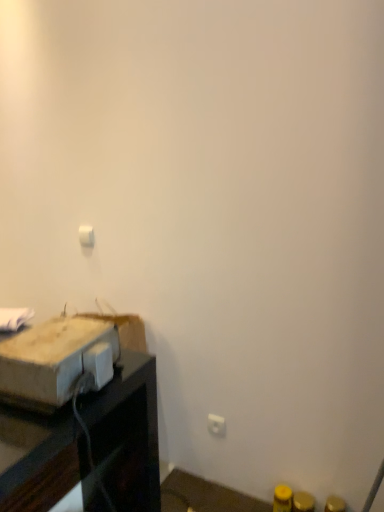
Question: From a real-world perspective, is white plastic light switch at upper center located higher than brown cardboard box at left?

Choices:
 (A) no
 (B) yes

Answer: (B)

Question: From the image's perspective, is white plastic light switch at upper center located beneath brown cardboard box at left?

Choices:
 (A) yes
 (B) no

Answer: (B)

Question: From the image's perspective, is white plastic light switch at upper center above brown cardboard box at left?

Choices:
 (A) yes
 (B) no

Answer: (A)

Question: Is white plastic light switch at upper center shorter than brown cardboard box at left?

Choices:
 (A) no
 (B) yes

Answer: (B)

Question: Is white plastic light switch at upper center positioned before brown cardboard box at left?

Choices:
 (A) no
 (B) yes

Answer: (A)

Question: Is white plastic light switch at upper center in contact with brown cardboard box at left?

Choices:
 (A) no
 (B) yes

Answer: (A)

Question: Considering the relative sizes of white plastic electric outlet at lower right and brown cardboard box at left in the image provided, is white plastic electric outlet at lower right taller than brown cardboard box at left?

Choices:
 (A) no
 (B) yes

Answer: (B)

Question: Is white plastic electric outlet at lower right to the left of brown cardboard box at left from the viewer's perspective?

Choices:
 (A) yes
 (B) no

Answer: (B)

Question: Does white plastic electric outlet at lower right have a larger size compared to brown cardboard box at left?

Choices:
 (A) no
 (B) yes

Answer: (A)

Question: From the image's perspective, is white plastic electric outlet at lower right below brown cardboard box at left?

Choices:
 (A) yes
 (B) no

Answer: (A)

Question: Does white plastic electric outlet at lower right have a lesser width compared to brown cardboard box at left?

Choices:
 (A) no
 (B) yes

Answer: (B)

Question: Is white plastic electric outlet at lower right in front of brown cardboard box at left?

Choices:
 (A) no
 (B) yes

Answer: (A)

Question: Is brown cardboard box at left placed right next to white plastic light switch at upper center?

Choices:
 (A) yes
 (B) no

Answer: (B)